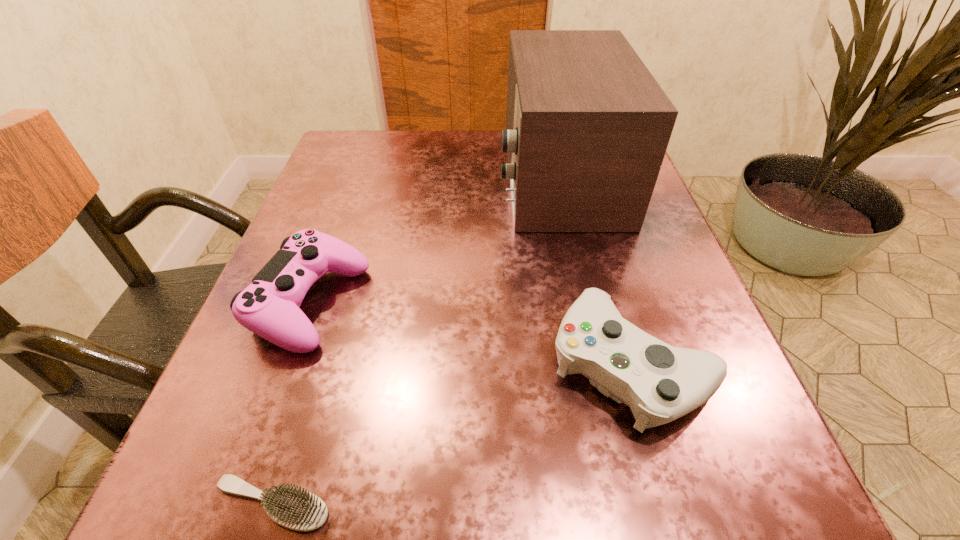
Where is `vacant space at the near edge of the desktop`? The width and height of the screenshot is (960, 540). vacant space at the near edge of the desktop is located at coordinates coord(502,512).

I want to click on vacant space at the left edge of the desktop, so click(x=349, y=296).

Where is `free space at the right edge of the desktop`? Image resolution: width=960 pixels, height=540 pixels. free space at the right edge of the desktop is located at coordinates (617, 269).

Locate an element on the screen. vacant space at the far left corner of the desktop is located at coordinates (336, 150).

I want to click on vacant space at the near left corner of the desktop, so click(x=181, y=479).

Image resolution: width=960 pixels, height=540 pixels. Find the location of `free space between the left control and the nearest object`. free space between the left control and the nearest object is located at coordinates (292, 403).

This screenshot has height=540, width=960. I want to click on vacant space that's between the right control and the scrubbing brush, so click(x=451, y=434).

Locate an element on the screen. The height and width of the screenshot is (540, 960). empty location between the radio receiver and the right control is located at coordinates tap(594, 269).

At what (x,y) coordinates should I click in order to perform the action: click on free space between the radio receiver and the right control. Please return your answer as a coordinate pair (x, y). Image resolution: width=960 pixels, height=540 pixels. Looking at the image, I should click on (594, 269).

Identify the location of vacant space in between the right control and the nearest object. The height and width of the screenshot is (540, 960). tap(451, 434).